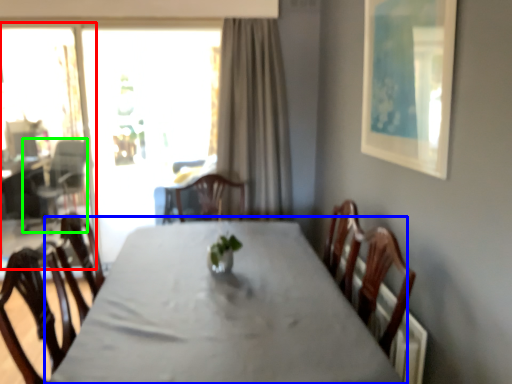
Question: Which object is positioned closest to screen door (highlighted by a red box)? Select from table (highlighted by a blue box) and armchair (highlighted by a green box).

Choices:
 (A) table
 (B) armchair

Answer: (B)